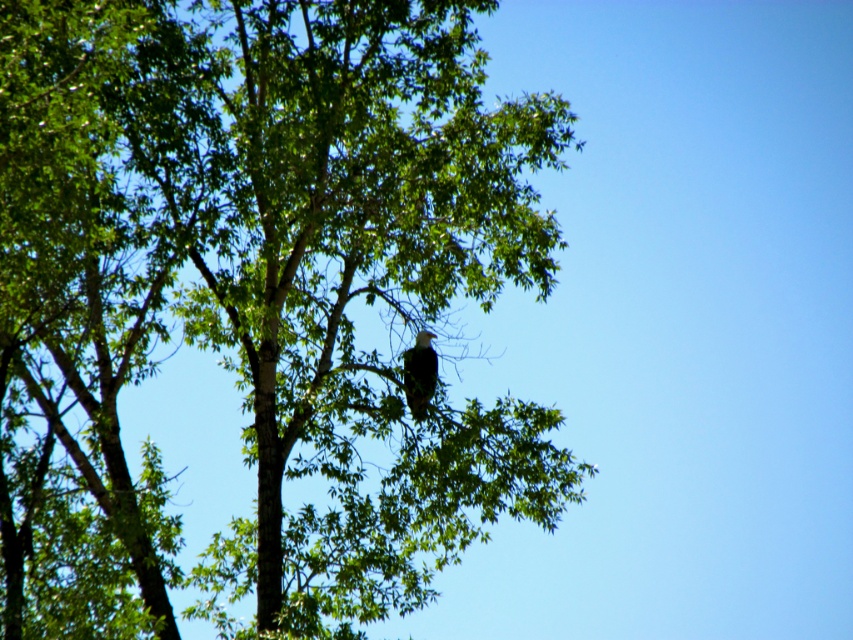
Is green leafy tree at center to the right of white feathered eagle at center from the viewer's perspective?

No, green leafy tree at center is not to the right of white feathered eagle at center.

How much distance is there between green leafy tree at center and white feathered eagle at center?

The distance of green leafy tree at center from white feathered eagle at center is 10.55 feet.

Does point (143, 67) come in front of point (413, 394)?

Yes, point (143, 67) is in front of point (413, 394).

Locate an element on the screen. The width and height of the screenshot is (853, 640). green leafy tree at center is located at coordinates (257, 291).